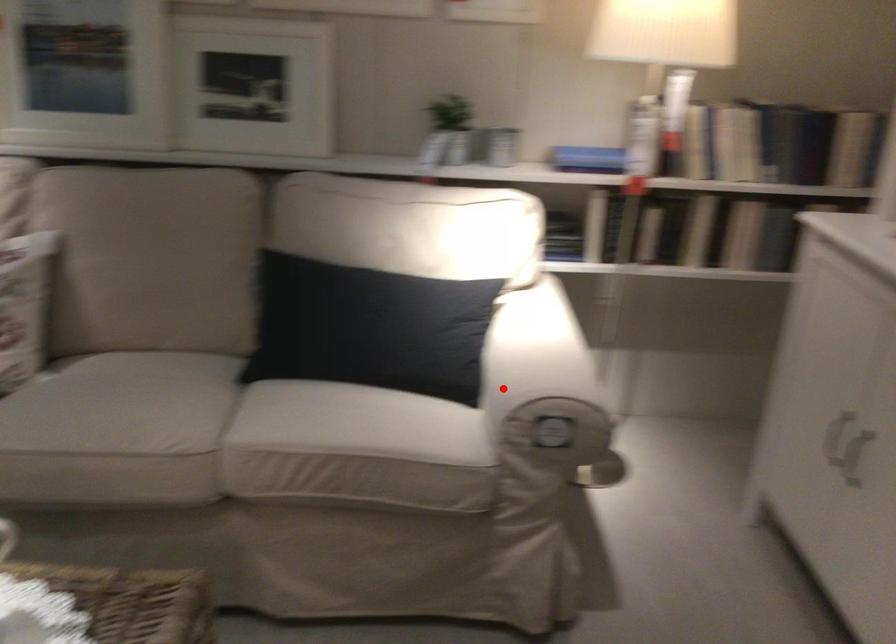
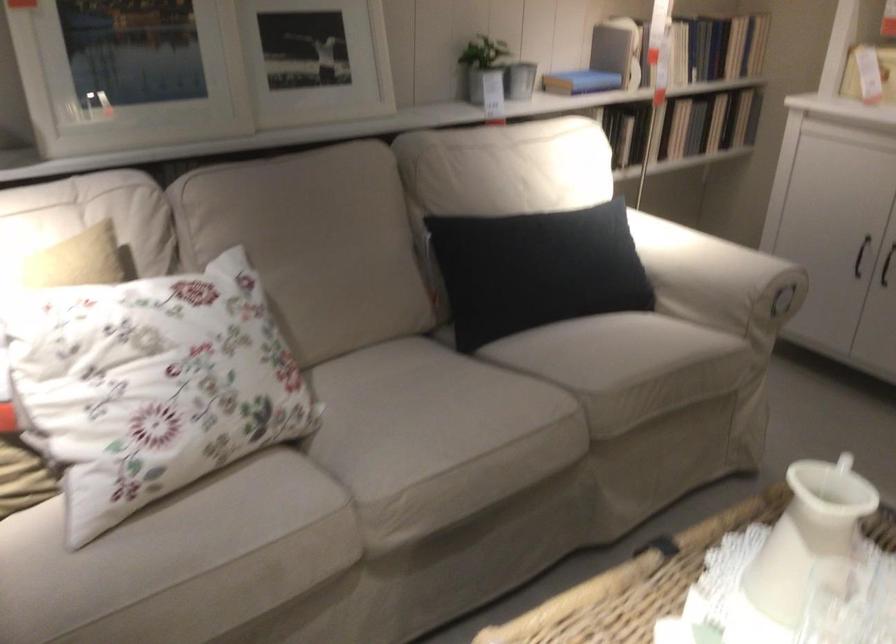
In the second image, find the point that corresponds to the highlighted location in the first image.

(717, 279)